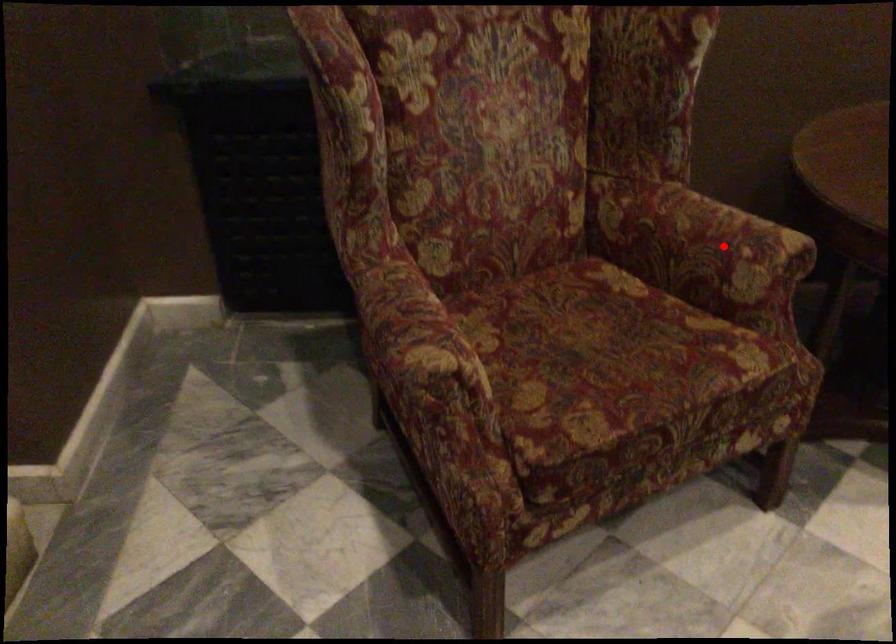
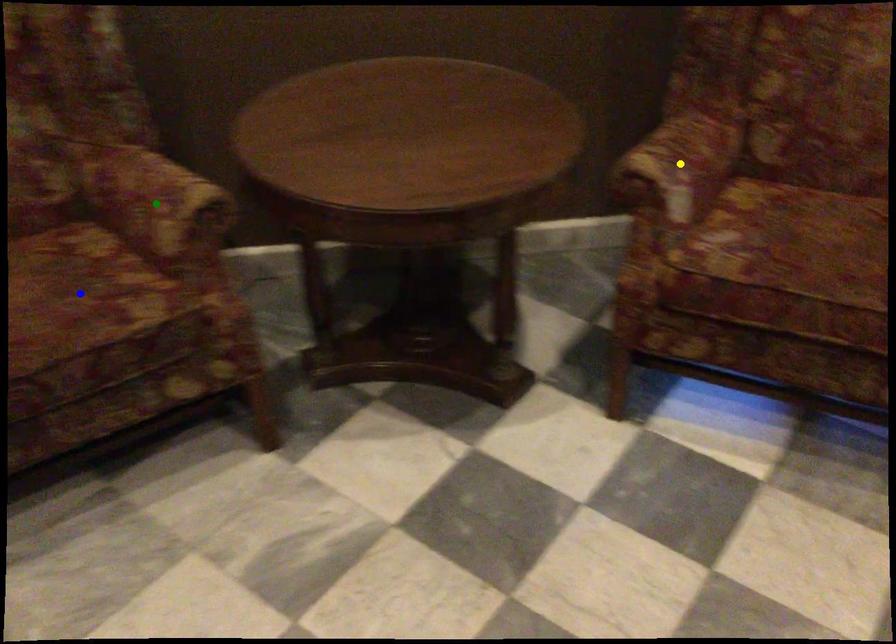
Question: I am providing you with two images of the same scene from different viewpoints. A red point is marked on the first image. You are given multiple points on the second image. Can you choose the point in image 2 that corresponds to the point in image 1?

Choices:
 (A) blue point
 (B) yellow point
 (C) green point

Answer: (C)